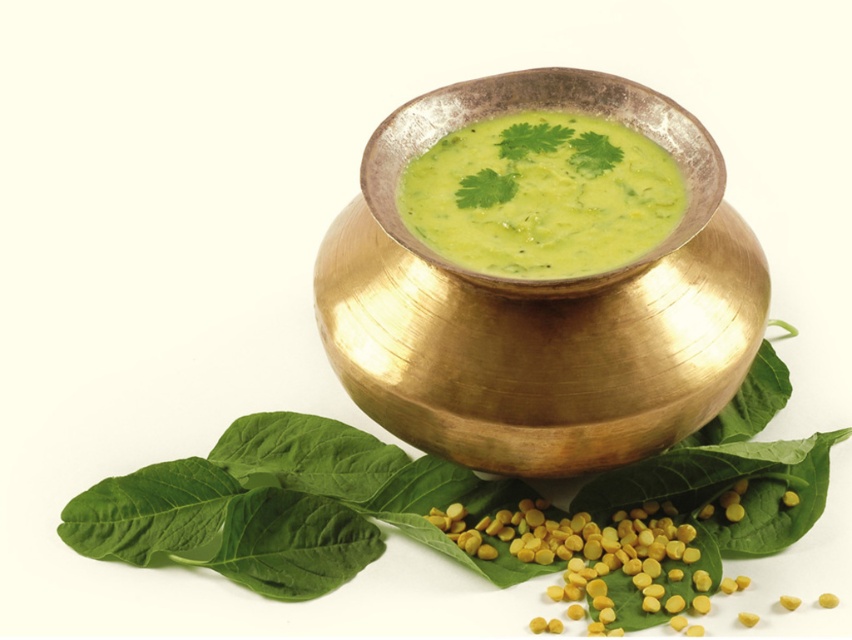
Is point (390, 266) positioned behind point (459, 141)?

No, (390, 266) is closer to viewer.

Can you confirm if gold metallic bowl at center is positioned to the left of green matte soup at center?

Incorrect, gold metallic bowl at center is not on the left side of green matte soup at center.

This screenshot has width=852, height=640. What do you see at coordinates (540, 305) in the screenshot?
I see `gold metallic bowl at center` at bounding box center [540, 305].

Where is `gold metallic bowl at center`? This screenshot has height=640, width=852. gold metallic bowl at center is located at coordinates (540, 305).

Can you confirm if gold metallic bowl at center is thinner than green leafy basil at lower left?

Indeed, gold metallic bowl at center has a lesser width compared to green leafy basil at lower left.

The image size is (852, 640). Describe the element at coordinates (540, 305) in the screenshot. I see `gold metallic bowl at center` at that location.

I want to click on gold metallic bowl at center, so click(540, 305).

Is green leafy basil at lower left closer to camera compared to green matte soup at center?

No, green leafy basil at lower left is behind green matte soup at center.

Which of these two, green leafy basil at lower left or green matte soup at center, stands taller?

With more height is green matte soup at center.

What do you see at coordinates (281, 508) in the screenshot? I see `green leafy basil at lower left` at bounding box center [281, 508].

Identify the location of green leafy basil at lower left. The height and width of the screenshot is (640, 852). (281, 508).